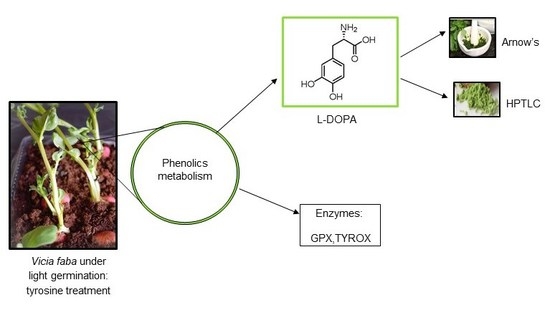
At what (x,y) coordinates should I click in order to perform the action: click on white item used to crush the leaves called a pestle. Please return your answer as a coordinate pair (x, y). The image size is (550, 310). Looking at the image, I should click on (474, 31).